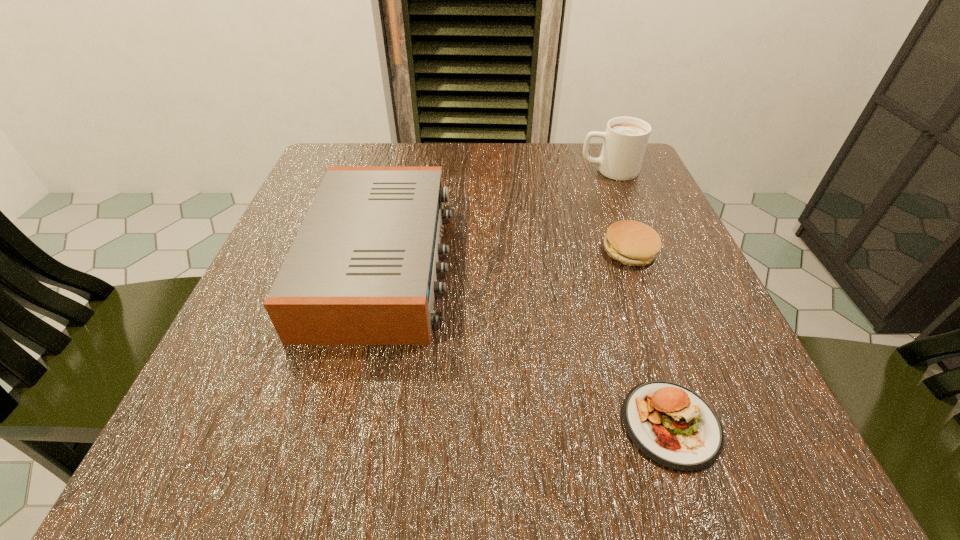
I want to click on empty location between the taller patty (food) and the radio receiver, so click(x=506, y=257).

Find the location of `vacant point located between the taller patty (food) and the cappuccino`. vacant point located between the taller patty (food) and the cappuccino is located at coordinates (619, 211).

Identify the location of free spot between the nearer patty (food) and the tallest object. The height and width of the screenshot is (540, 960). (639, 297).

You are a GUI agent. You are given a task and a screenshot of the screen. Output one action in this format:
    pyautogui.click(x=<x>, y=<y>)
    Task: Click on the free area in between the third tallest object and the radio receiver
    The image size is (960, 540).
    Given the screenshot: What is the action you would take?
    pyautogui.click(x=506, y=257)

At what (x,y) coordinates should I click in order to perform the action: click on empty space that is in between the leftmost object and the taller patty (food). Please return your answer as a coordinate pair (x, y). Image resolution: width=960 pixels, height=540 pixels. Looking at the image, I should click on (506, 257).

At what (x,y) coordinates should I click in order to perform the action: click on free area in between the second tallest object and the tallest object. Please return your answer as a coordinate pair (x, y). This screenshot has height=540, width=960. Looking at the image, I should click on (495, 217).

Where is `empty space that is in between the tallest object and the shortest object`? The height and width of the screenshot is (540, 960). empty space that is in between the tallest object and the shortest object is located at coordinates (639, 297).

Identify which object is the nearest to the shortest object. Please provide its 2D coordinates. Your answer should be formatted as a tuple, i.e. [(x, y)], where the tuple contains the x and y coordinates of a point satisfying the conditions above.

[(631, 242)]

The width and height of the screenshot is (960, 540). What are the coordinates of `object that stands as the closest to the third shortest object` in the screenshot? It's located at (669, 423).

This screenshot has width=960, height=540. Find the location of `vacant region that satisfies the following two spatial constraints: 1. on the front panel of the radio receiver; 2. on the back side of the shortest object`. vacant region that satisfies the following two spatial constraints: 1. on the front panel of the radio receiver; 2. on the back side of the shortest object is located at coordinates (344, 424).